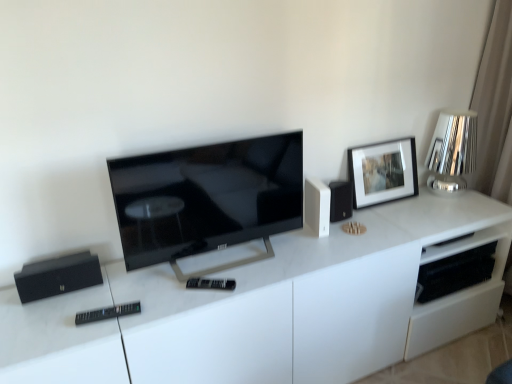
Where is `free space below matte black tv at center (from a real-world perspective)`? free space below matte black tv at center (from a real-world perspective) is located at coordinates (224, 266).